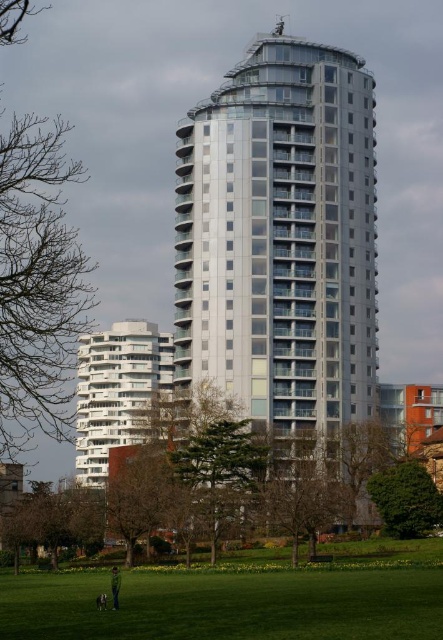
Who is higher up, silver/glassy tower at center or green leafy tree at lower right?

silver/glassy tower at center is above.

Is silver/glassy tower at center behind green leafy tree at lower right?

Yes.

Between point (241, 109) and point (432, 520), which one is positioned in front?

Point (432, 520) is more forward.

Identify the location of silver/glassy tower at center. (280, 240).

Between silver/glassy tower at center and brown textured tree at center, which one is positioned higher?

Positioned higher is silver/glassy tower at center.

Measure the distance between silver/glassy tower at center and brown textured tree at center.

They are 45.81 feet apart.

In order to click on silver/glassy tower at center in this screenshot , I will do `click(280, 240)`.

The height and width of the screenshot is (640, 443). What are the coordinates of `silver/glassy tower at center` in the screenshot? It's located at (280, 240).

Can you confirm if brown textured tree at center is smaller than green leafy tree at lower left?

No.

From the picture: Is brown textured tree at center further to camera compared to green leafy tree at lower left?

No, brown textured tree at center is closer to the viewer.

Who is more distant from viewer, (299, 524) or (85, 500)?

Positioned behind is point (85, 500).

The width and height of the screenshot is (443, 640). What are the coordinates of `brown textured tree at center` in the screenshot? It's located at (303, 488).